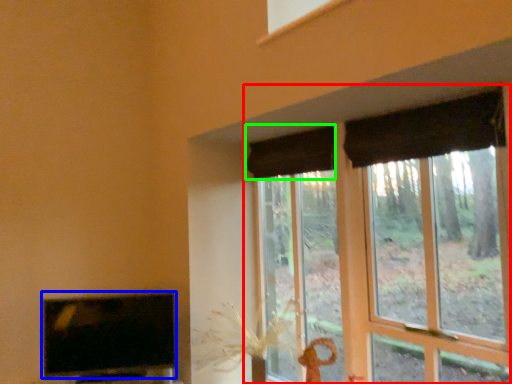
Question: Estimate the real-world distances between objects in this image. Which object is closer to window (highlighted by a red box), television (highlighted by a blue box) or curtain (highlighted by a green box)?

Choices:
 (A) television
 (B) curtain

Answer: (B)